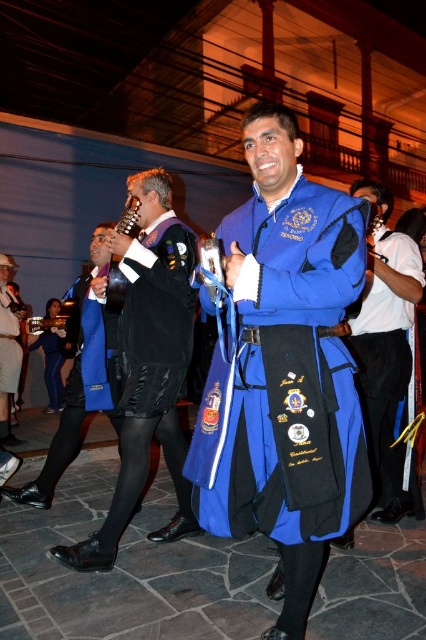
You are standing at the center of the event and want to hand the blue satin sash at center to someone across the stage. If the stage is 10 feet wide, can you reach the other side without moving?

The blue satin sash at center is 8.11 feet away from the viewer. Since the stage is 10 feet wide, the distance from the center to the edge is 5 feet. Since 8.11 feet exceeds 5 feet, you cannot reach the other side without moving.

You are standing at the edge of the event area and notice the black leather shoes at lower left and the brushed metal violin at center. Which object is positioned lower in the image?

The black leather shoes at lower left is positioned lower than the brushed metal violin at center.